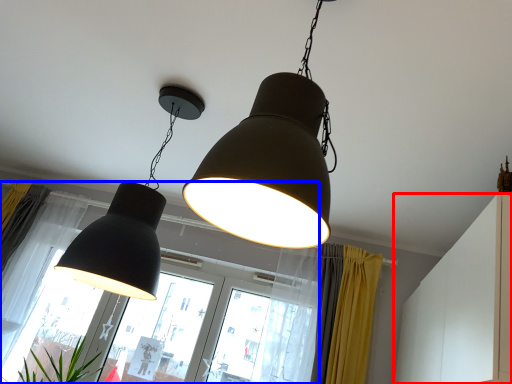
Question: Which object is further to the camera taking this photo, dresser (highlighted by a red box) or bay window (highlighted by a blue box)?

Choices:
 (A) dresser
 (B) bay window

Answer: (B)